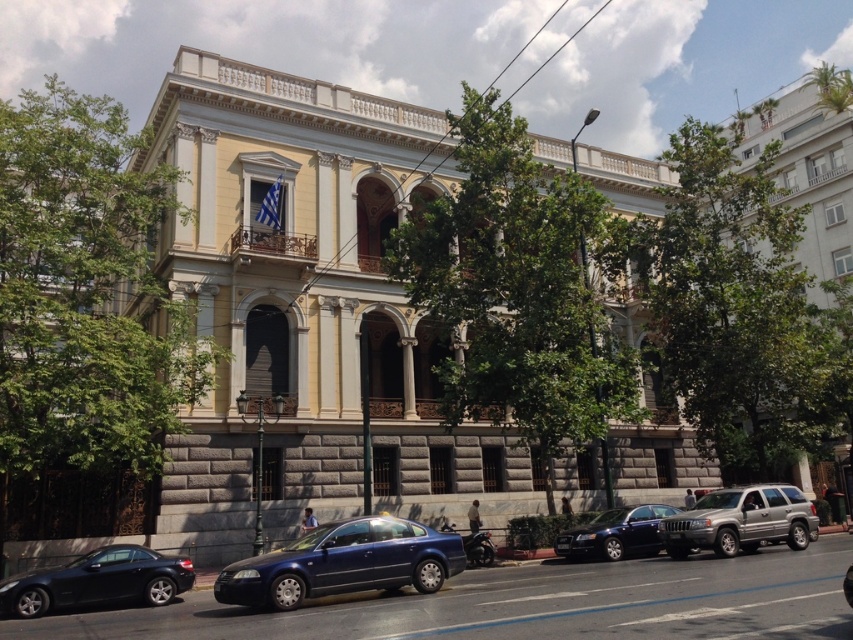
You are a pedestrian standing on the sidewalk in front of the grand classical building. You see the shiny black car at lower left and the shiny black sedan at center. Which car is closer to you?

The shiny black car at lower left is closer to you because it is in front of the shiny black sedan at center.

You are a delivery person trying to park your van between the glossy metallic sedan at center and the silver metallic suv at center. Can you fit your van, which is 2 meters wide, in the space between them?

The glossy metallic sedan at center is positioned on the left side of silver metallic suv at center, but the distance between them isn

Based on the photo, you are a delivery person with a cart that is 2 meters wide. You need to navigate between the silver metallic suv at center and the shiny black sedan at center to reach the building entrance. Is there enough space for your cart to pass through?

The distance between the silver metallic suv at center and the shiny black sedan at center is 3.56 meters. Since your cart is 2 meters wide, there is sufficient space for it to pass through the gap between the two vehicles.